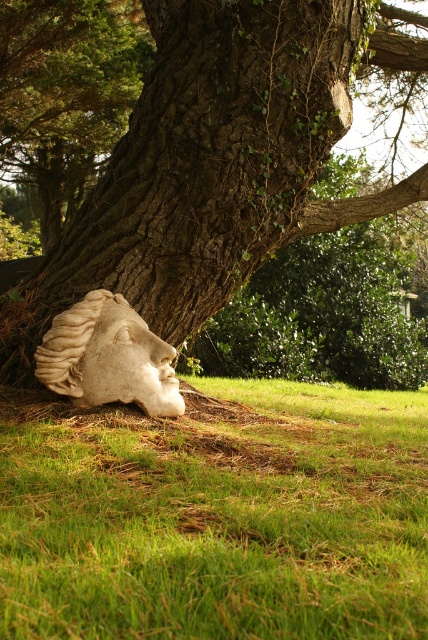
Which is above, dark brown textured bark at center or white stone head at lower left?

dark brown textured bark at center is higher up.

Does dark brown textured bark at center lie behind white stone head at lower left?

Yes, it is behind white stone head at lower left.

Between point (169, 6) and point (55, 358), which one is positioned behind?

Positioned behind is point (169, 6).

This screenshot has height=640, width=428. What are the coordinates of `dark brown textured bark at center` in the screenshot? It's located at (204, 164).

Can you confirm if green grass at lower center is positioned above dark brown textured bark at center?

Incorrect, green grass at lower center is not positioned above dark brown textured bark at center.

Between green grass at lower center and dark brown textured bark at center, which one appears on the right side from the viewer's perspective?

Positioned to the right is green grass at lower center.

Which is behind, point (76, 442) or point (320, 214)?

Positioned behind is point (320, 214).

The width and height of the screenshot is (428, 640). I want to click on green grass at lower center, so click(216, 515).

Which of these two, green grass at lower center or white stone head at lower left, stands shorter?

green grass at lower center is shorter.

Does point (344, 602) come closer to viewer compared to point (77, 356)?

Yes, it is in front of point (77, 356).

Between point (356, 468) and point (127, 323), which one is positioned in front?

Positioned in front is point (356, 468).

Find the location of a particular element. Image resolution: width=428 pixels, height=640 pixels. green grass at lower center is located at coordinates (216, 515).